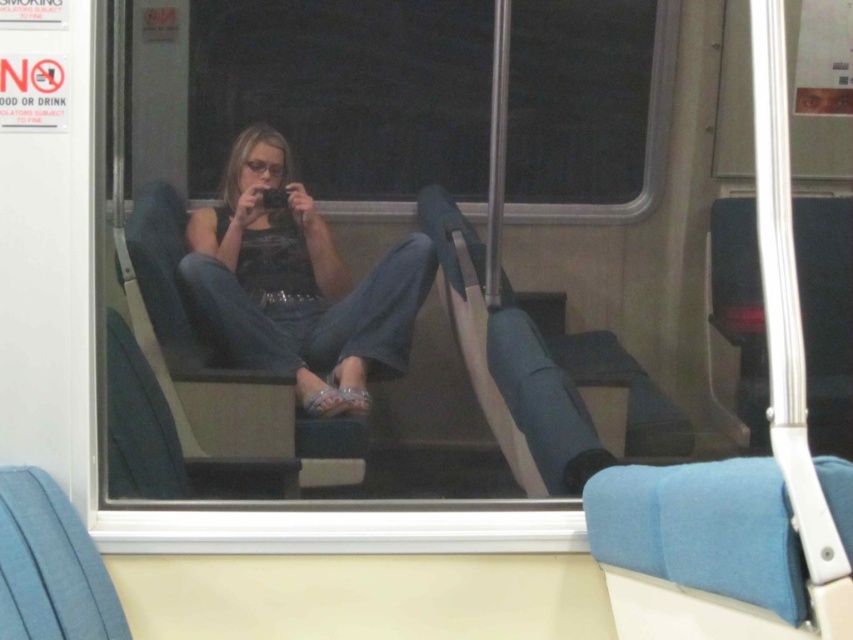
Who is more distant from viewer, (318,401) or (654,147)?

Point (654,147)

Does point (364, 381) come farther from viewer compared to point (657, 72)?

That is False.

This screenshot has height=640, width=853. I want to click on denim jeans at center, so click(x=299, y=285).